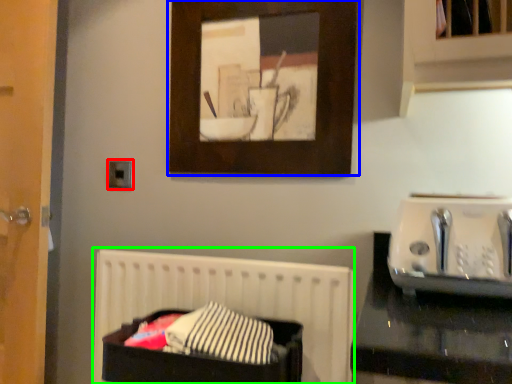
Question: Considering the real-world distances, which object is farthest from electric outlet (highlighted by a red box)? picture frame (highlighted by a blue box) or bed (highlighted by a green box)?

Choices:
 (A) picture frame
 (B) bed

Answer: (A)